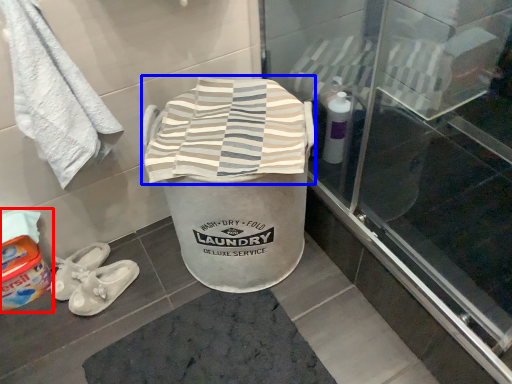
Question: Which object appears farthest to the camera in this image, wash (highlighted by a red box) or beach towel (highlighted by a blue box)?

Choices:
 (A) wash
 (B) beach towel

Answer: (A)